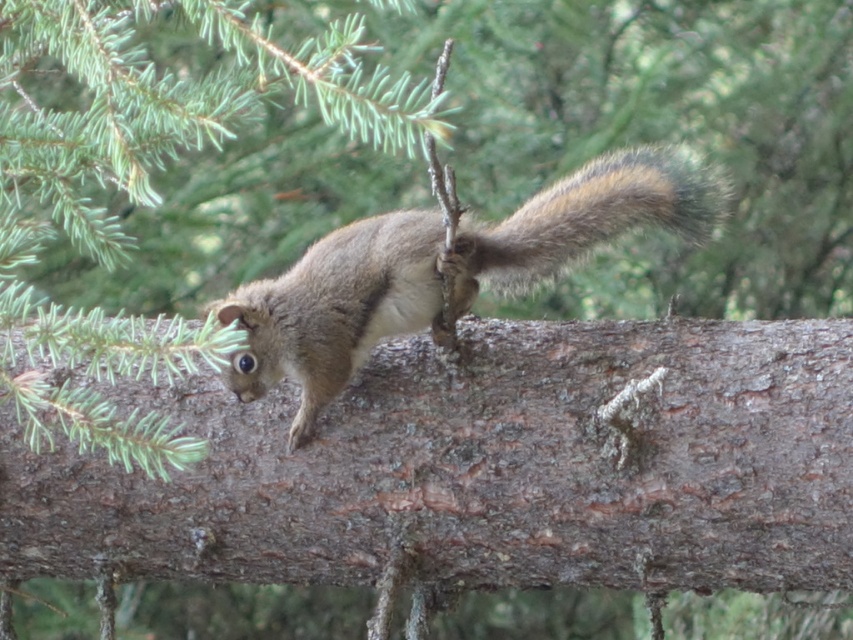
You are a nature photographer aiming to capture the brown fur squirrel at center and the fuzzy brown tail at center in a single shot. Which part of the squirrel should appear closer to the camera lens?

The brown fur squirrel at center is in front of the fuzzy brown tail at center, so the squirrel will appear closer to the camera lens.

You are a photographer trying to capture the squirrel on the branch. You notice a specific point marked at coordinates point (444,269). Based on the scene, where is this point located on the squirrel?

The point (444,269) is located on the brown fur squirrel at center.

Where is the brown fur squirrel at center located in the image?

The brown fur squirrel at center is located at point [444,269].